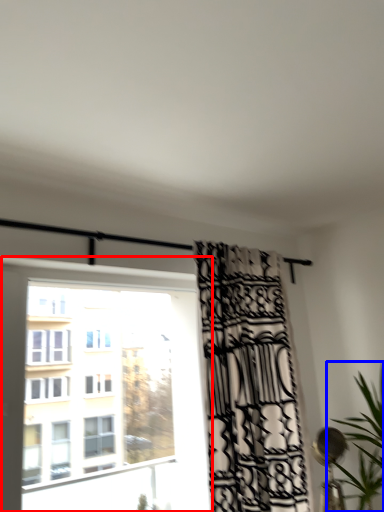
Question: Which object appears closest to the camera in this image, window (highlighted by a red box) or houseplant (highlighted by a blue box)?

Choices:
 (A) window
 (B) houseplant

Answer: (A)